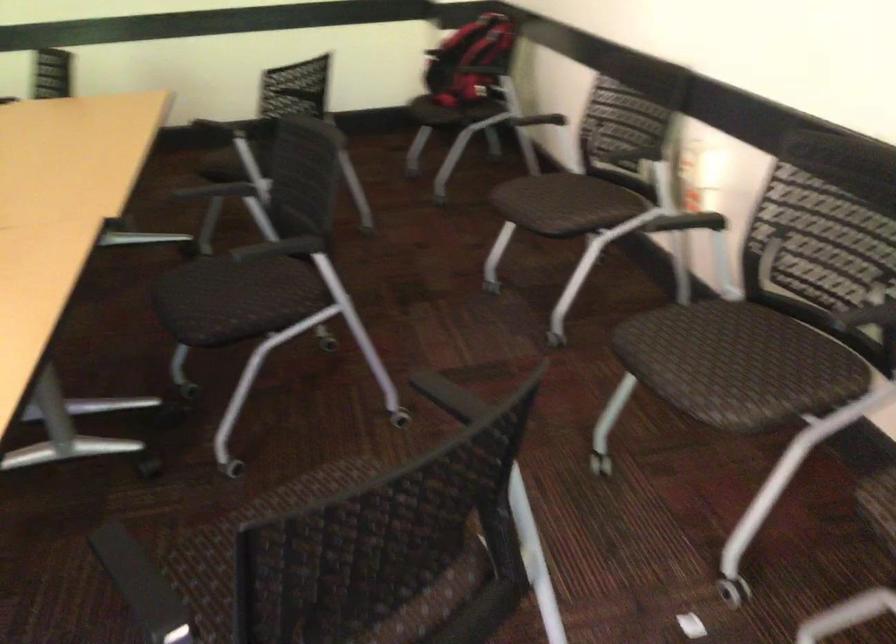
Which object does [471,61] point to?

It refers to a red backpack.